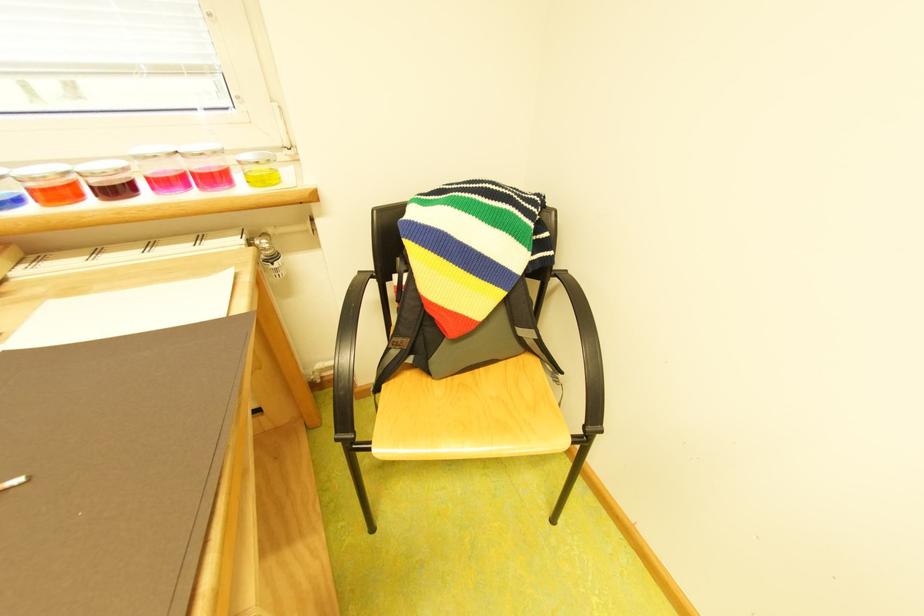
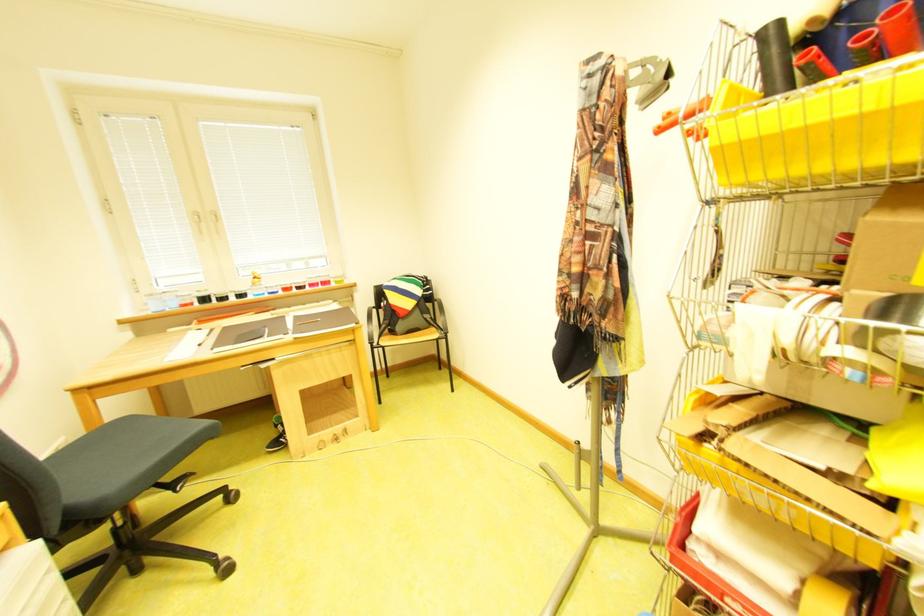
The point at (138, 171) is marked in the first image. Where is the corresponding point in the second image?

(315, 283)